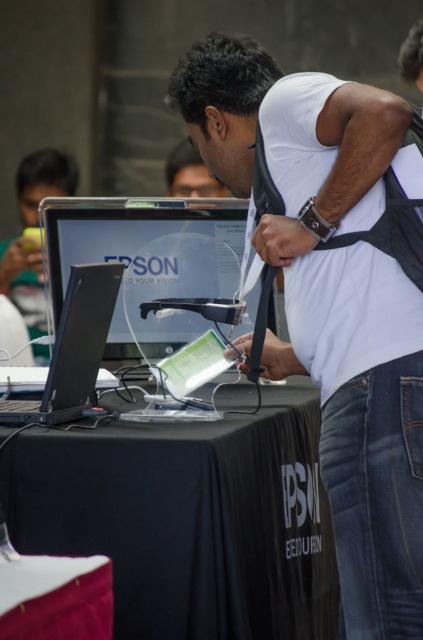
Does black fabric table at center appear over black fabric table at lower center?

Yes, black fabric table at center is above black fabric table at lower center.

Between point (208, 522) and point (49, 632), which one is positioned behind?

Point (208, 522)

In order to click on black fabric table at center in this screenshot , I will do `click(189, 518)`.

Does black matte laptop at center appear under white matte shirt at upper center?

Yes.

Who is positioned more to the left, black matte laptop at center or white matte shirt at upper center?

black matte laptop at center is more to the left.

The width and height of the screenshot is (423, 640). Describe the element at coordinates (73, 349) in the screenshot. I see `black matte laptop at center` at that location.

Image resolution: width=423 pixels, height=640 pixels. In order to click on black matte laptop at center in this screenshot , I will do `click(73, 349)`.

Measure the distance from satin black monitor at center to white matte shirt at upper center.

satin black monitor at center is 1.96 meters from white matte shirt at upper center.

Who is higher up, satin black monitor at center or white matte shirt at upper center?

Positioned higher is white matte shirt at upper center.

Does point (87, 230) lie behind point (208, 189)?

No, (87, 230) is closer to viewer.

I want to click on satin black monitor at center, so click(148, 260).